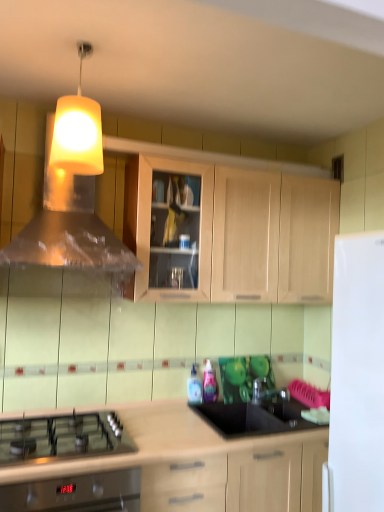
Question: Considering the relative positions of translucent plastic bottle at center, the 1th bottle from the left, and translucent plastic bottle at center, marked as the first bottle in a right-to-left arrangement, in the image provided, is translucent plastic bottle at center, the 1th bottle from the left, to the left or to the right of translucent plastic bottle at center, marked as the first bottle in a right-to-left arrangement,?

Choices:
 (A) left
 (B) right

Answer: (A)

Question: From the image's perspective, is translucent plastic bottle at center, the 1th bottle from the left, located above or below translucent plastic bottle at center, the second bottle when ordered from left to right?

Choices:
 (A) below
 (B) above

Answer: (A)

Question: Which of these objects is positioned closest to the yellow matte lampshade at upper center?

Choices:
 (A) light wood cabinet at lower center, the first cabinetry from the bottom
 (B) transparent glass tap at center
 (C) light wood cabinet at upper center, which ranks as the 2th cabinetry in bottom-to-top order
 (D) translucent plastic vent at upper center
 (E) translucent plastic bottle at center, the 1th bottle from the left

Answer: (D)

Question: Which object is the farthest from the yellow matte lampshade at upper center?

Choices:
 (A) light wood cabinet at lower center, the first cabinetry from the bottom
 (B) translucent plastic bottle at center, the second bottle when ordered from left to right
 (C) translucent plastic bottle at center, placed as the 2th bottle when sorted from right to left
 (D) black glass gas stove at lower left
 (E) light wood cabinet at upper center, which appears as the 1th cabinetry when viewed from the top

Answer: (B)